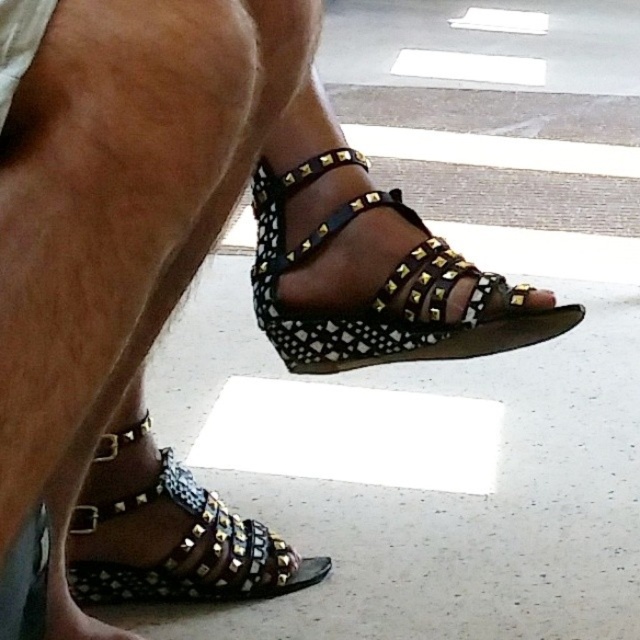
Looking at the black studded wedge at center and the matte black sandal at center, which one is positioned more to the left side?

The black studded wedge at center is positioned to the left of the matte black sandal at center, so it is more to the left side.

You are standing in front of the person wearing the sandals and looking at their feet. There are two points marked on the ground near their feet. Which point is closer to you, point (148, 436) or point (538, 289)?

Answer: Point (148, 436) is closer to you because it is further to the viewer than point (538, 289).